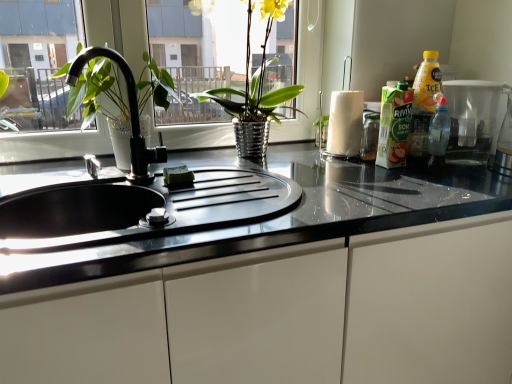
Question: Does shiny metallic vase at center have a lesser height compared to translucent plastic container at right?

Choices:
 (A) no
 (B) yes

Answer: (A)

Question: Are shiny metallic vase at center and translucent plastic container at right located far from each other?

Choices:
 (A) no
 (B) yes

Answer: (A)

Question: Does shiny metallic vase at center have a larger size compared to translucent plastic container at right?

Choices:
 (A) yes
 (B) no

Answer: (A)

Question: From the image's perspective, is shiny metallic vase at center over translucent plastic container at right?

Choices:
 (A) no
 (B) yes

Answer: (B)

Question: Does shiny metallic vase at center appear on the right side of translucent plastic container at right?

Choices:
 (A) yes
 (B) no

Answer: (B)

Question: From the image's perspective, is translucent plastic bottle at right located above or below transparent plastic bottle at right?

Choices:
 (A) below
 (B) above

Answer: (B)

Question: Relative to transparent plastic bottle at right, is translucent plastic bottle at right in front or behind?

Choices:
 (A) front
 (B) behind

Answer: (B)

Question: Considering the positions of translucent plastic bottle at right and transparent plastic bottle at right in the image, is translucent plastic bottle at right bigger or smaller than transparent plastic bottle at right?

Choices:
 (A) small
 (B) big

Answer: (B)

Question: Considering the positions of translucent plastic bottle at right and transparent plastic bottle at right in the image, is translucent plastic bottle at right taller or shorter than transparent plastic bottle at right?

Choices:
 (A) short
 (B) tall

Answer: (B)

Question: In the image, is shiny metallic vase at center positioned in front of or behind white glossy paper towel at center right?

Choices:
 (A) front
 (B) behind

Answer: (A)

Question: Does point (239, 104) appear closer or farther from the camera than point (345, 94)?

Choices:
 (A) farther
 (B) closer

Answer: (A)

Question: In terms of width, does shiny metallic vase at center look wider or thinner when compared to white glossy paper towel at center right?

Choices:
 (A) thin
 (B) wide

Answer: (B)

Question: Considering the positions of shiny metallic vase at center and white glossy paper towel at center right in the image, is shiny metallic vase at center bigger or smaller than white glossy paper towel at center right?

Choices:
 (A) big
 (B) small

Answer: (A)

Question: From a real-world perspective, is shiny metallic vase at center positioned above or below transparent plastic bottle at right?

Choices:
 (A) below
 (B) above

Answer: (B)

Question: In the image, is shiny metallic vase at center on the left side or the right side of transparent plastic bottle at right?

Choices:
 (A) right
 (B) left

Answer: (B)